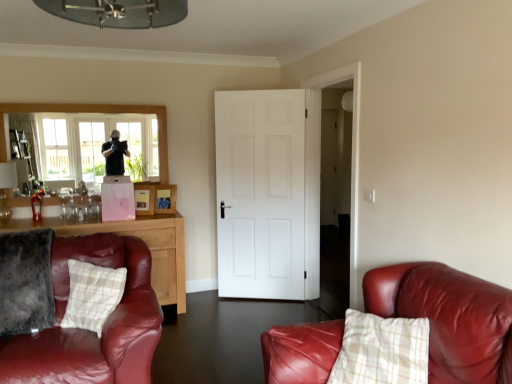
Find the location of a particular element. free spot in front of white matte door at center is located at coordinates (257, 320).